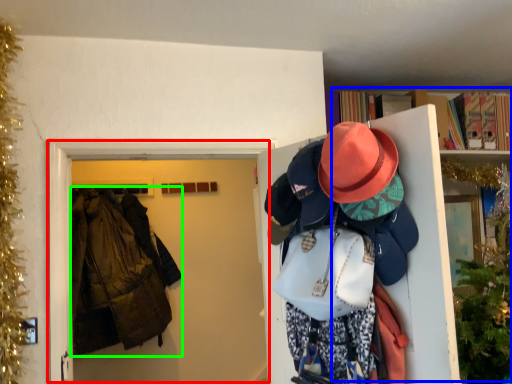
Question: Which object is the closest to the door (highlighted by a red box)? Choose among these: bookcase (highlighted by a blue box) or jacket (highlighted by a green box).

Choices:
 (A) bookcase
 (B) jacket

Answer: (B)